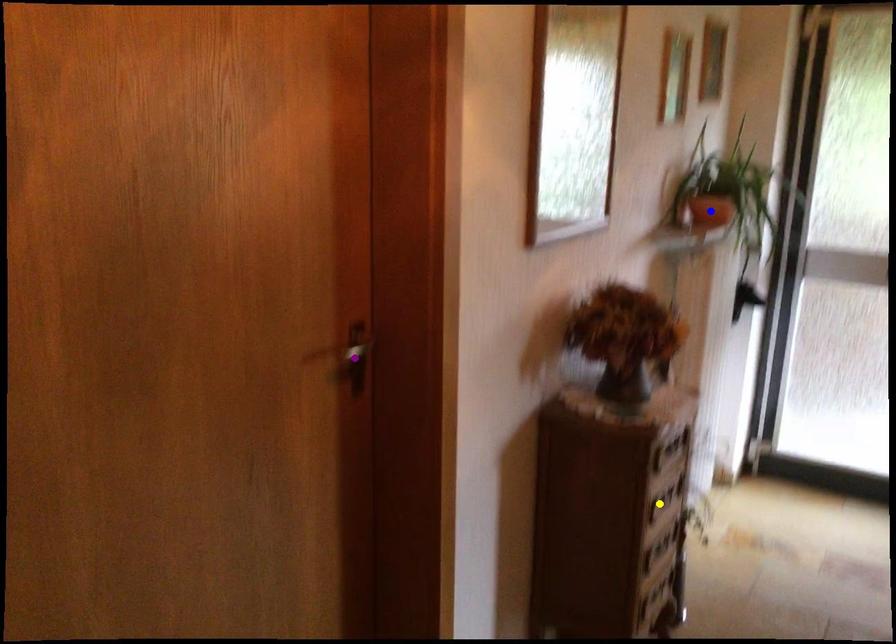
Order these from nearest to farthest:
purple point
yellow point
blue point

1. purple point
2. yellow point
3. blue point